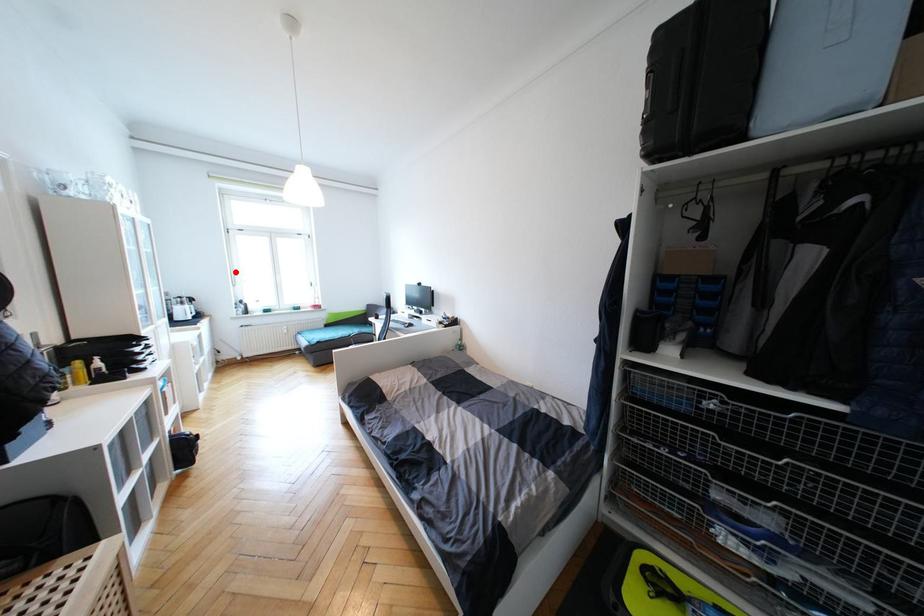
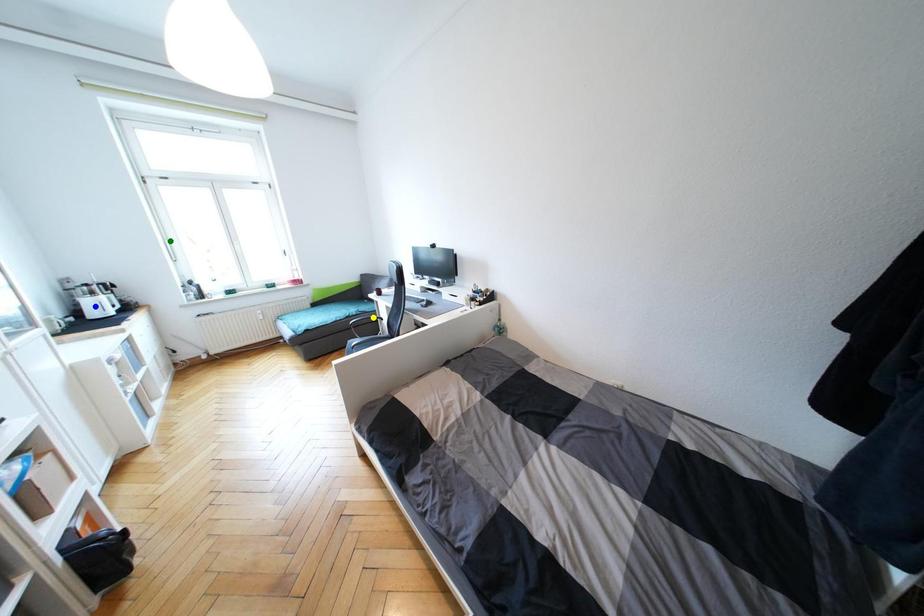
Question: I am providing you with two images of the same scene from different viewpoints. A red point is marked on the first image. You are given multiple points on the second image. Which point in image 2 is actually the same real-world point as the red point in image 1?

Choices:
 (A) yellow point
 (B) green point
 (C) blue point

Answer: (B)